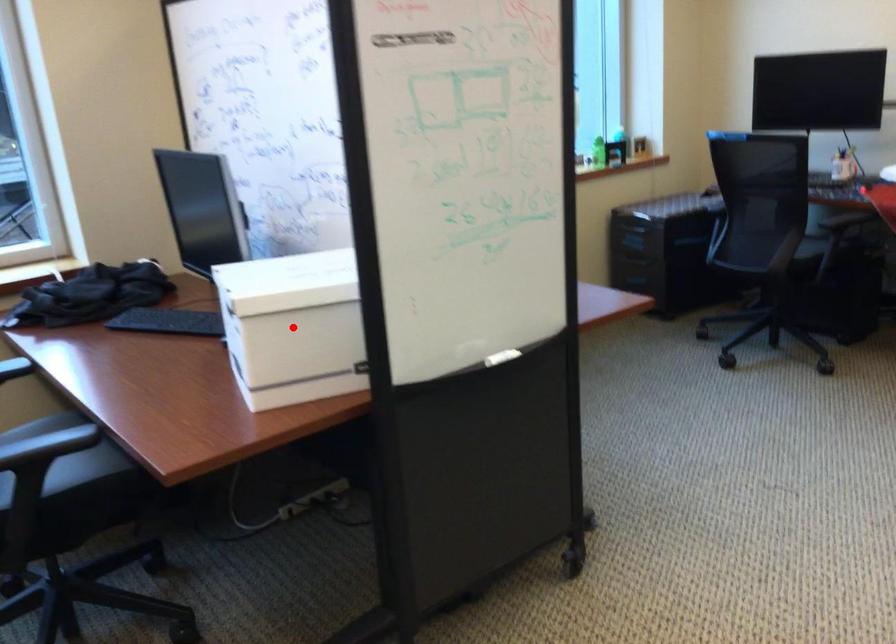
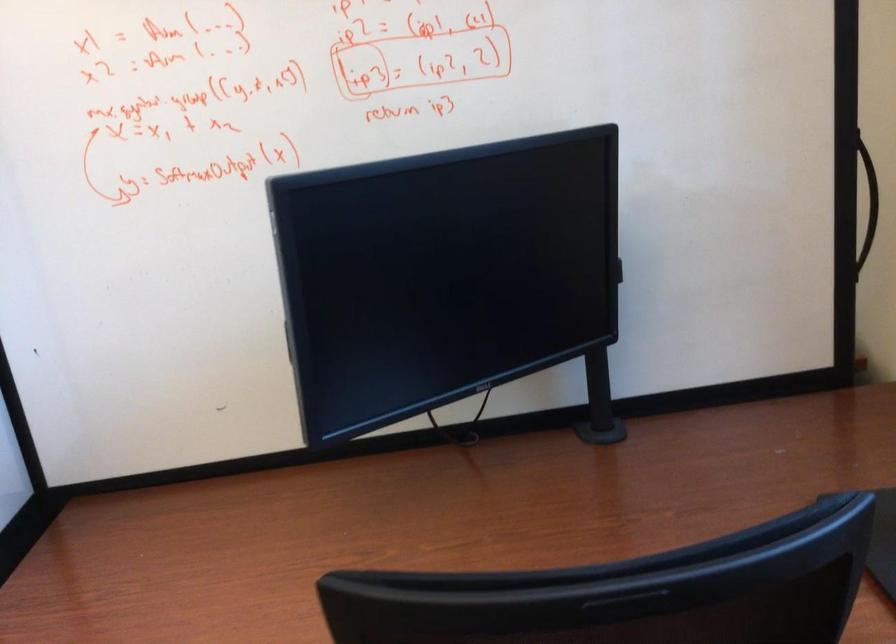
Question: I am providing you with two images of the same scene from different viewpoints. A red point is marked on the first image. At the location where the point appears in image 1, is it still visible in image 2?

Choices:
 (A) Yes
 (B) No

Answer: (B)